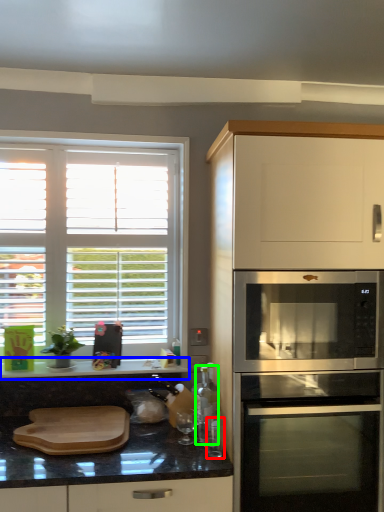
Question: Estimate the real-world distances between objects in this image. Which object is farther from appliance (highlighted by a red box), countertop (highlighted by a blue box) or bottle (highlighted by a green box)?

Choices:
 (A) countertop
 (B) bottle

Answer: (A)